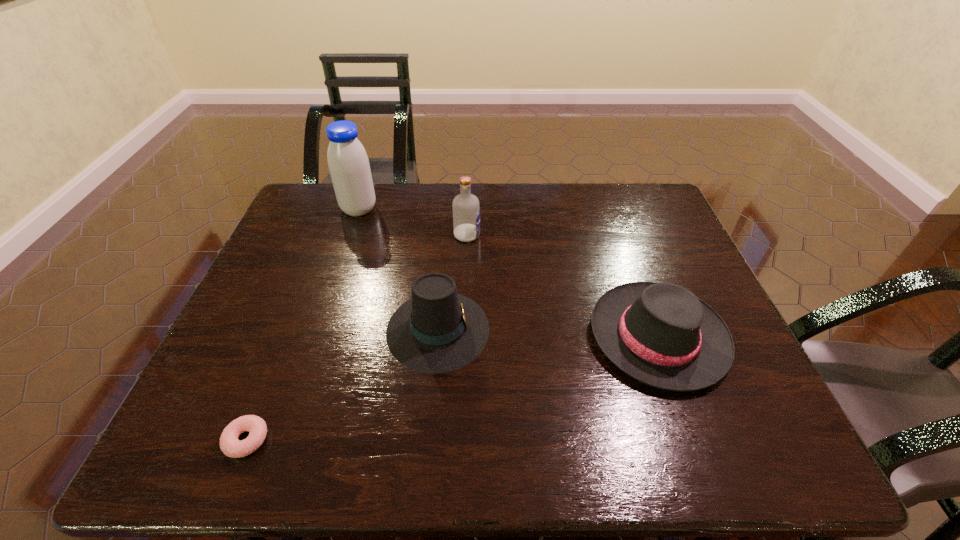
Locate an element on the screen. vacant space that is in between the shortest object and the third tallest object is located at coordinates (343, 384).

Image resolution: width=960 pixels, height=540 pixels. Identify the location of vacant point located between the farthest object and the taller dress hat. (398, 269).

Locate an element on the screen. The image size is (960, 540). free space between the doughnut and the third shortest object is located at coordinates (343, 384).

What are the coordinates of `free space between the farthest object and the left dress hat` in the screenshot? It's located at (398, 269).

Find the location of a particular element. This screenshot has height=540, width=960. vacant point located between the taller dress hat and the second shortest object is located at coordinates (548, 333).

Identify the location of free area in between the left dress hat and the farthest object. The width and height of the screenshot is (960, 540). (398, 269).

Identify which object is the closest to the right dress hat. Please provide its 2D coordinates. Your answer should be formatted as a tuple, i.e. [(x, y)], where the tuple contains the x and y coordinates of a point satisfying the conditions above.

[(438, 330)]

Identify which object is the third nearest to the doughnut. Please provide its 2D coordinates. Your answer should be formatted as a tuple, i.e. [(x, y)], where the tuple contains the x and y coordinates of a point satisfying the conditions above.

[(348, 163)]

Image resolution: width=960 pixels, height=540 pixels. What are the coordinates of `vacant space that satisfies the following two spatial constraints: 1. on the front-facing side of the left dress hat; 2. on the front side of the doughnut` in the screenshot? It's located at (428, 440).

Where is `vacant position in the image that satisfies the following two spatial constraints: 1. on the front-facing side of the taller dress hat; 2. on the back side of the rightmost object`? This screenshot has height=540, width=960. vacant position in the image that satisfies the following two spatial constraints: 1. on the front-facing side of the taller dress hat; 2. on the back side of the rightmost object is located at coordinates (438, 336).